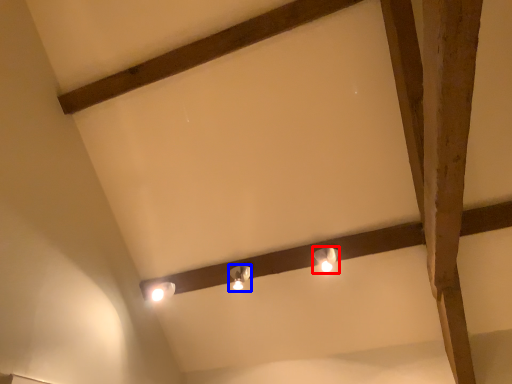
Question: Which object appears closest to the camera in this image, lamp (highlighted by a red box) or lamp (highlighted by a blue box)?

Choices:
 (A) lamp
 (B) lamp

Answer: (A)